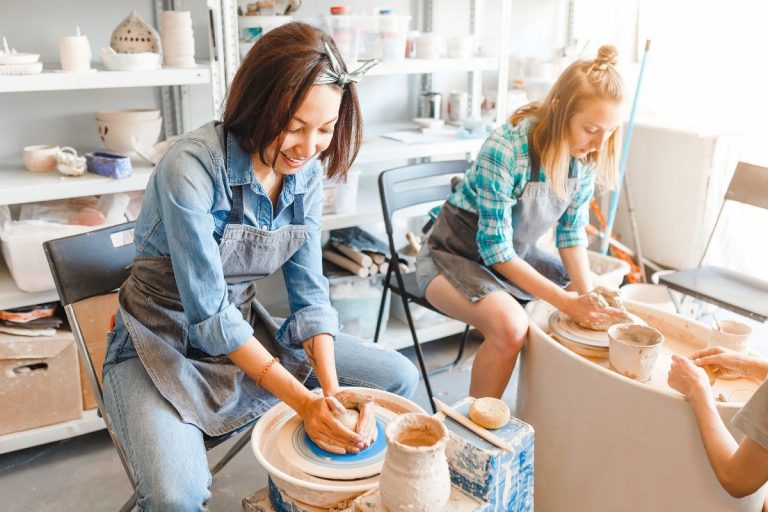
Locate an element on the screen. This screenshot has width=768, height=512. box is located at coordinates (42, 375).